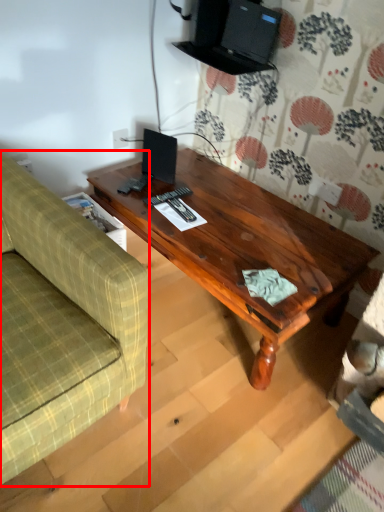
Question: Observing the image, what is the correct spatial positioning of studio couch (annotated by the red box) in reference to coffee table?

Choices:
 (A) right
 (B) left

Answer: (B)